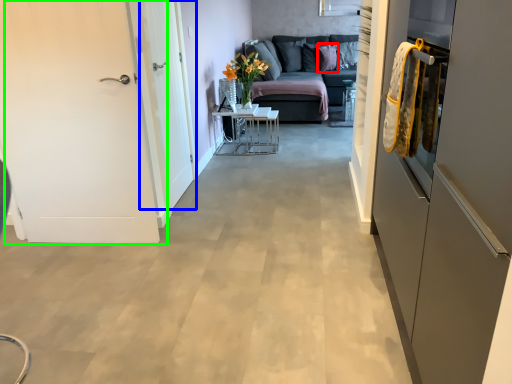
Question: Which is nearer to the pillow (highlighted by a red box)? door (highlighted by a blue box) or door (highlighted by a green box).

Choices:
 (A) door
 (B) door

Answer: (A)